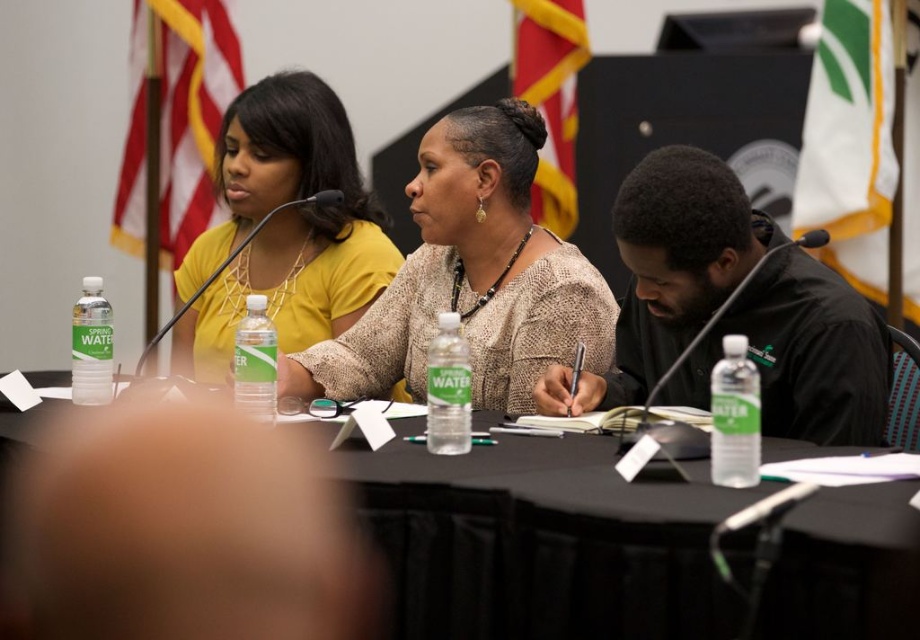
Who is lower down, black fabric table at center or clear plastic water bottle at right?

Positioned lower is black fabric table at center.

What do you see at coordinates (542, 544) in the screenshot? The height and width of the screenshot is (640, 920). I see `black fabric table at center` at bounding box center [542, 544].

Is point (589, 448) positioned before point (725, 476)?

That is False.

Find the location of `black fabric table at center`. black fabric table at center is located at coordinates (542, 544).

Is clear plastic water bottle at right shorter than clear plastic bottle at center?

Indeed, clear plastic water bottle at right has a lesser height compared to clear plastic bottle at center.

Does clear plastic water bottle at right have a greater height compared to clear plastic bottle at center?

No.

Locate an element on the screen. The width and height of the screenshot is (920, 640). clear plastic water bottle at right is located at coordinates (734, 417).

Does beige textured sweater at center have a smaller size compared to matte yellow shirt at upper left?

Yes.

In the scene shown: Between beige textured sweater at center and matte yellow shirt at upper left, which one has more height?

matte yellow shirt at upper left

Does point (311, 381) lie in front of point (346, 227)?

Yes.

This screenshot has width=920, height=640. In order to click on beige textured sweater at center in this screenshot , I will do pos(470,276).